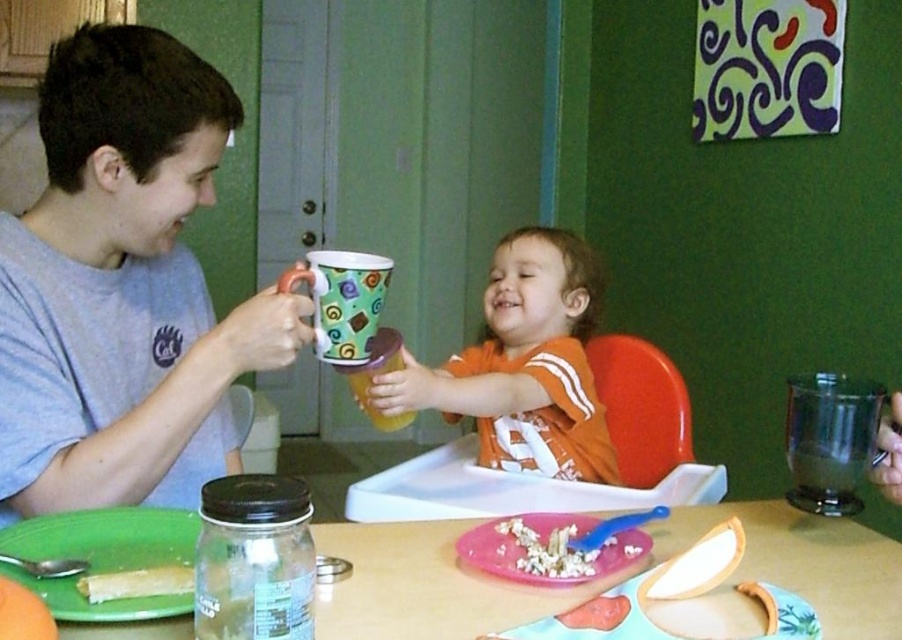
Question: Among these objects, which one is nearest to the camera?

Choices:
 (A) orange plastic chair at center
 (B) smooth yellow corn at center
 (C) matte plastic cup at center

Answer: (B)

Question: Estimate the real-world distances between objects in this image. Which object is farther from the orange plastic chair at center?

Choices:
 (A) crumbly white popcorn at center
 (B) smooth yellow corn at center
 (C) matte plastic cup at center
 (D) orange cotton shirt at center

Answer: (B)

Question: Where is crumbly white popcorn at center located in relation to smooth pink cake at lower center in the image?

Choices:
 (A) above
 (B) below

Answer: (A)

Question: Which of the following is the closest to the observer?

Choices:
 (A) green matte mug at center
 (B) smooth pink cake at lower center
 (C) smooth yellow corn at center
 (D) crumbly white popcorn at center

Answer: (C)

Question: Where is matte gray t-shirt at left located in relation to green matte mug at center in the image?

Choices:
 (A) below
 (B) above

Answer: (B)

Question: Where is green matte mug at center located in relation to smooth pink cake at lower center in the image?

Choices:
 (A) above
 (B) below

Answer: (A)